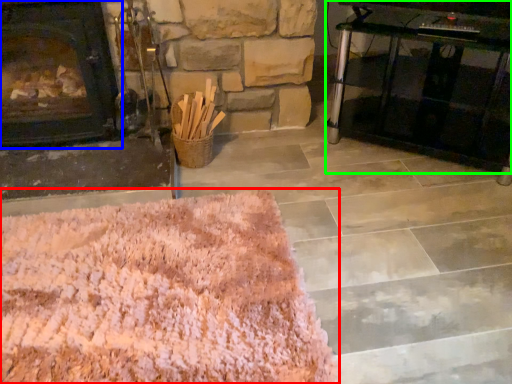
Question: Which object is the closest to the mat (highlighted by a red box)? Choose among these: fireplace (highlighted by a blue box) or table (highlighted by a green box).

Choices:
 (A) fireplace
 (B) table

Answer: (A)